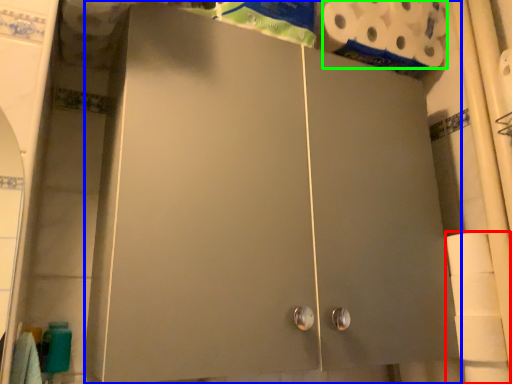
Question: Considering the real-world distances, which object is closest to toilet paper (highlighted by a red box)? cupboard (highlighted by a blue box) or toilet paper (highlighted by a green box).

Choices:
 (A) cupboard
 (B) toilet paper

Answer: (A)